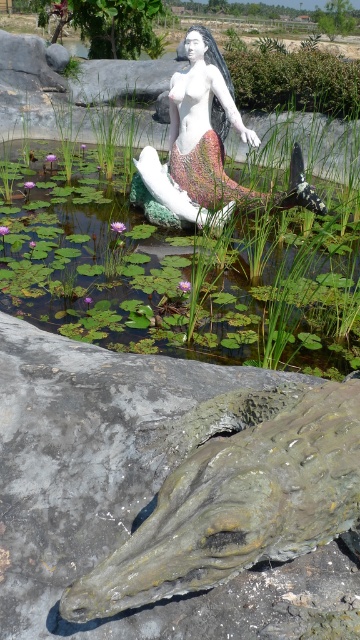
You are standing in the scene and want to place a small decorative rock. The rock must be placed exactly at the coordinates provided for the green leafy water at center. Where should you place the rock?

Place the small decorative rock at the coordinates point (x=176, y=273) where the green leafy water at center is located.

Looking at this image, you are a maintenance worker who needs to clean the white glossy mermaid at center. You have a 30 inch long pole. Can you reach the mermaid from the green leafy water at center using the pole?

The green leafy water at center is 30.88 inches away from the white glossy mermaid at center. Since the pole is only 30 inches long, it is 0.88 inches shorter than needed. Therefore, you cannot reach the mermaid with the pole from the green leafy water at center.

You are standing in the scene and want to place a small potted plant on the gray rough stone at lower center. Where exactly should you place it?

You should place the small potted plant at point (122, 493) on the gray rough stone at lower center.